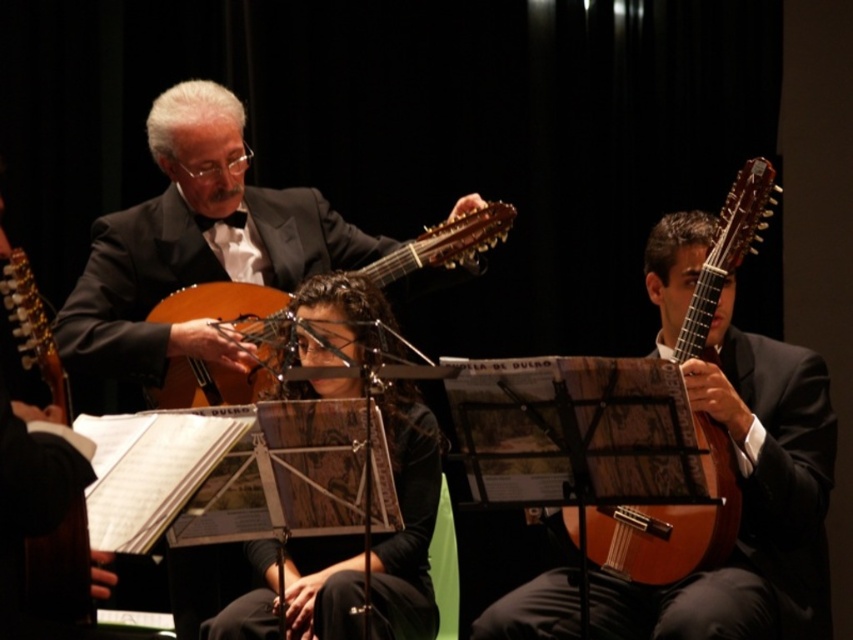
You are a stagehand who needs to position a microphone stand for the musician playing the wooden acoustic guitar at right. According to the coordinates provided, where should you place the microphone stand relative to the stage?

The wooden acoustic guitar at right is located at coordinates point (666, 522), so the microphone stand should be placed near that position to capture the sound effectively.

You are an event planner setting up a stage for a classical music performance. You need to place a decorative podium for the conductor exactly between the shiny black suit at center and the music stand. Given their coordinates, where should you position the podium?

The podium should be placed at the midpoint between the shiny black suit at center and the music stand. Since the shiny black suit is at coordinates point [196,246] and the music stand is at point [426,320], the midpoint would be at approximately point [311,283].